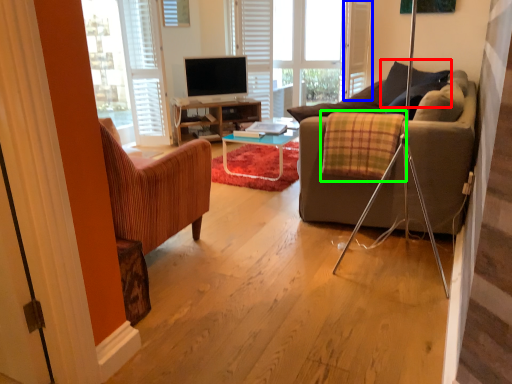
Question: Which object is positioned farthest from pillow (highlighted by a red box)? Select from screen door (highlighted by a blue box) and plaid (highlighted by a green box).

Choices:
 (A) screen door
 (B) plaid

Answer: (A)